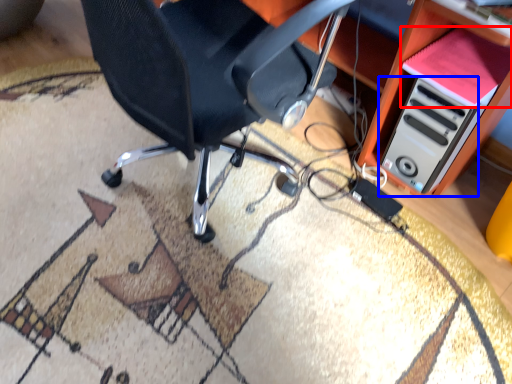
Question: Which object appears closest to the camera in this image, book (highlighted by a red box) or computer tower (highlighted by a blue box)?

Choices:
 (A) book
 (B) computer tower

Answer: (A)